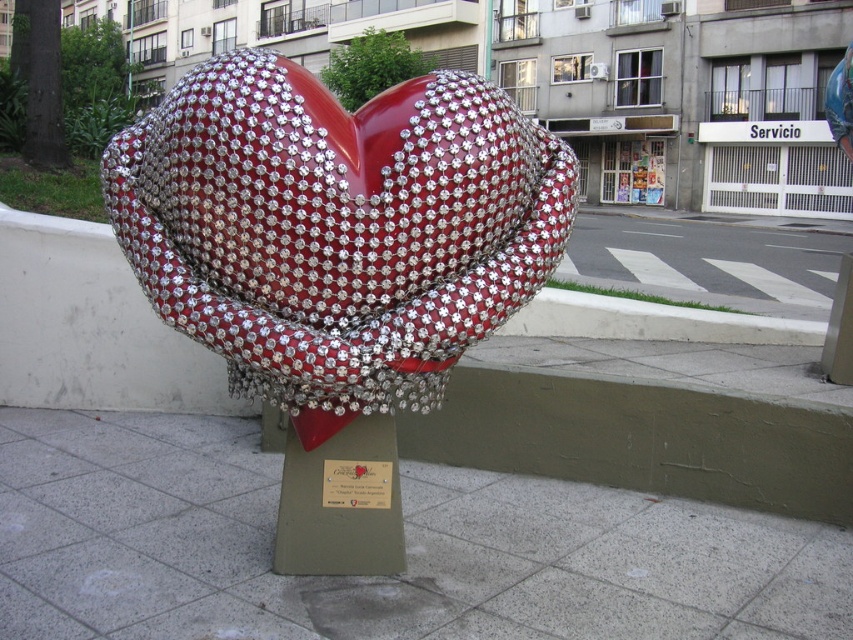
Is shiny metallic heart at center further to the viewer compared to metallic plaque at center?

That is False.

Between point (447, 208) and point (358, 483), which one is positioned in front?

Point (447, 208) is in front.

Identify the location of shiny metallic heart at center. This screenshot has height=640, width=853. (335, 257).

Between point (537, 634) and point (581, 465), which one is positioned behind?

Point (581, 465)

Who is more distant from viewer, [763,541] or [213,362]?

Point [213,362]

Identify the location of white tile pavement at center. The width and height of the screenshot is (853, 640). (378, 577).

Which is more to the left, shiny metallic heart at center or green concrete curb at center?

shiny metallic heart at center

From the picture: Between shiny metallic heart at center and green concrete curb at center, which one is positioned lower?

green concrete curb at center is lower down.

Is point (351, 342) positioned before point (531, 328)?

Yes.

Identify the location of shiny metallic heart at center. The height and width of the screenshot is (640, 853). (335, 257).